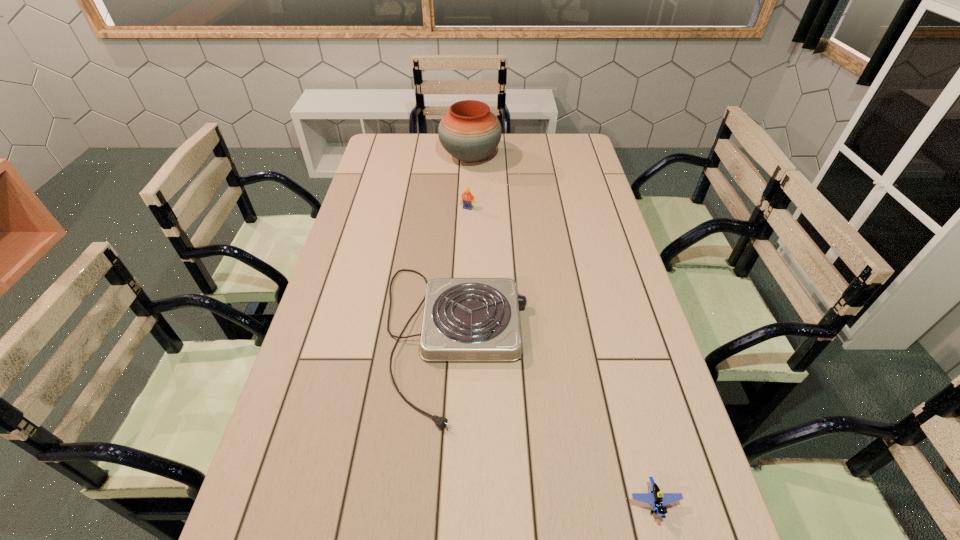
What are the coordinates of `vacant area that lies between the farther Lego and the pottery` in the screenshot? It's located at (469, 183).

Image resolution: width=960 pixels, height=540 pixels. I want to click on free space that is in between the shorter Lego and the tallest object, so click(x=563, y=330).

Identify the location of free spot between the pottery and the farther Lego. This screenshot has width=960, height=540. (469, 183).

This screenshot has width=960, height=540. In order to click on free space between the farthest object and the third farthest object in this screenshot , I will do `click(463, 248)`.

You are a GUI agent. You are given a task and a screenshot of the screen. Output one action in this format:
    pyautogui.click(x=<x>, y=<y>)
    Task: Click on the free space that is in between the second farthest object and the nearer Lego
    The width and height of the screenshot is (960, 540).
    Given the screenshot: What is the action you would take?
    pyautogui.click(x=561, y=355)

Locate an element on the screen. The image size is (960, 540). blank region between the tallest object and the third farthest object is located at coordinates (463, 248).

The height and width of the screenshot is (540, 960). I want to click on object that ranks as the closest to the third farthest object, so click(655, 497).

Locate an element on the screen. The image size is (960, 540). object that stands as the third closest to the third farthest object is located at coordinates (469, 132).